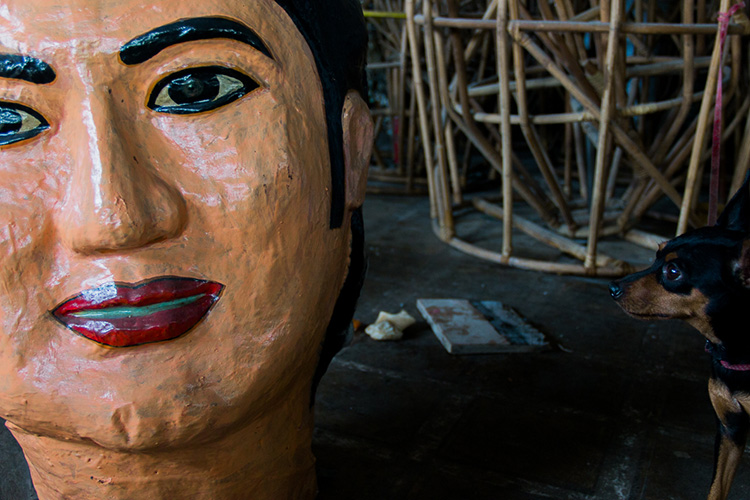
Identify the location of sculpture. Image resolution: width=750 pixels, height=500 pixels. (246, 195).